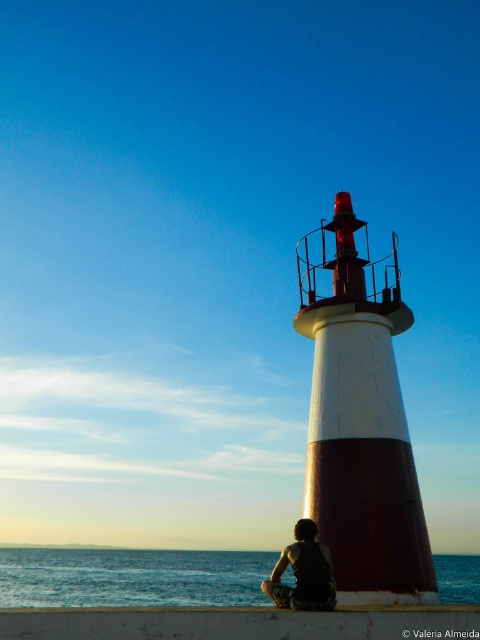
You are standing at the lighthouse and want to place a small flag at each of the two points labeled point (132, 557) and point (297, 593). Which point is closer to you so that you can place the flag without moving your position?

Point (132, 557) is closer to you than point (297, 593), so you can place the flag there without moving.

Based on the photo, you are standing at the center of the image and want to move towards the blue water at lower left. Which direction should you face to walk directly towards it?

The blue water at lower left is located at point [132,577], which is to the lower left direction from your current position at the center. You should face towards the lower left to walk directly towards the blue water at lower left.

You are a photographer standing at the camera position. You want to place a 1.2 meter tall tripod on the white concrete ledge at lower center. Will the ledge be tall enough to hold the tripod?

The white concrete ledge at lower center is 11.35 meters from camera, so the distance is not related to the height of the tripod. The height of the ledge itself is not provided, so it is unknown if it can hold the tripod.